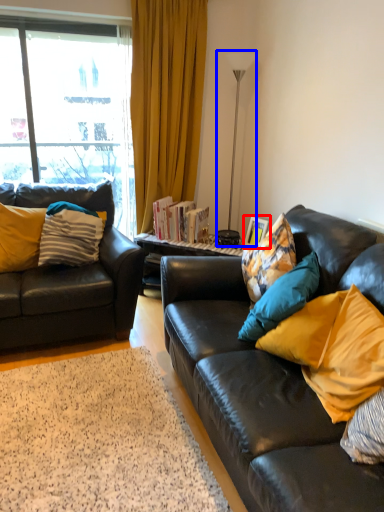
Question: Which object appears farthest to the camera in this image, picture frame (highlighted by a red box) or lamp (highlighted by a blue box)?

Choices:
 (A) picture frame
 (B) lamp

Answer: (A)